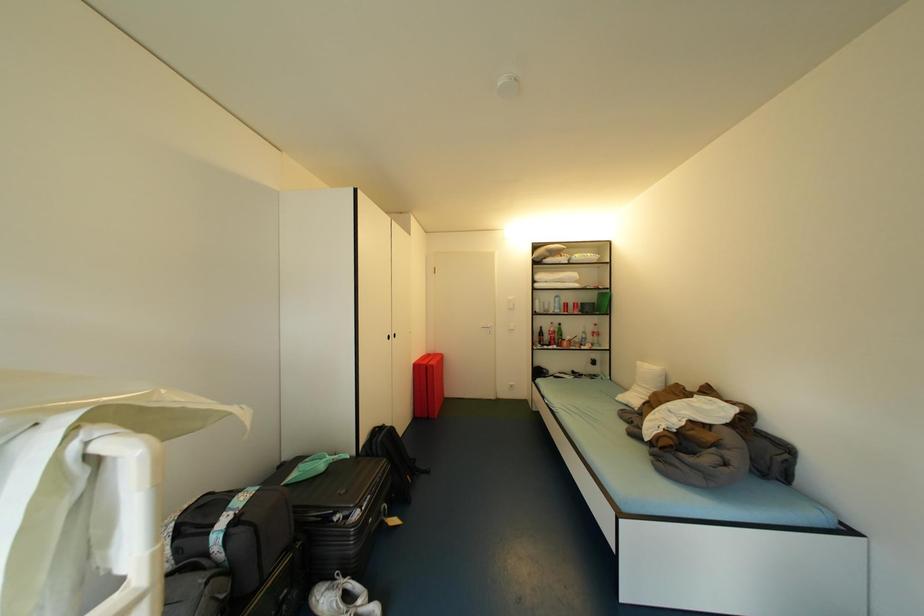
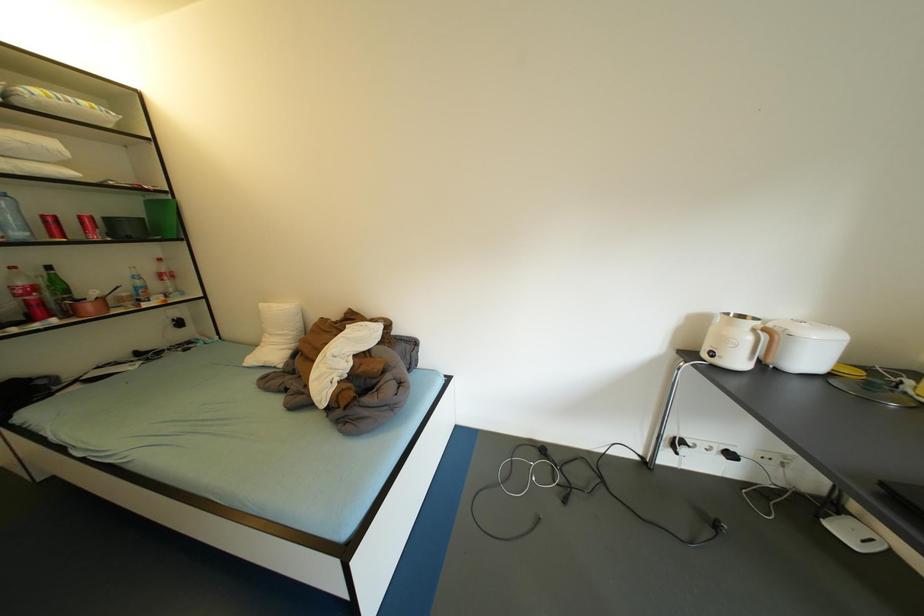
The first image is from the beginning of the video and the second image is from the end. How did the camera likely rotate when shooting the video?

The rotation direction of the camera is right-down.